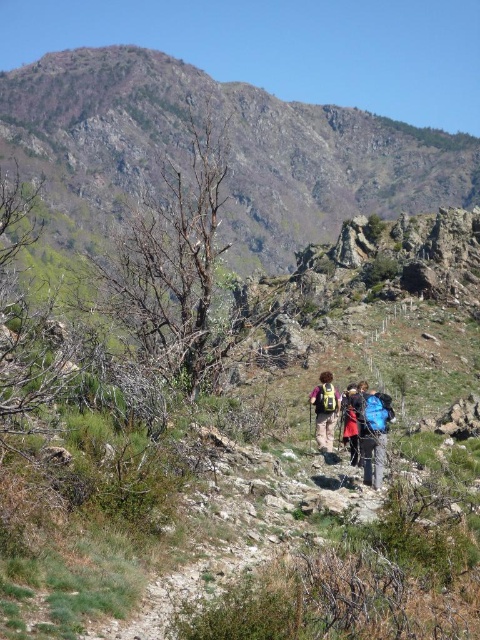
Can you confirm if rugged rock mountain at center is positioned to the left of blue fabric backpack at center?

Indeed, rugged rock mountain at center is positioned on the left side of blue fabric backpack at center.

Is rugged rock mountain at center shorter than blue fabric backpack at center?

No, rugged rock mountain at center is not shorter than blue fabric backpack at center.

At what (x,y) coordinates should I click in order to perform the action: click on rugged rock mountain at center. Please return your answer as a coordinate pair (x, y). This screenshot has height=640, width=480. Looking at the image, I should click on (229, 150).

Who is shorter, blue fabric backpack at center or yellow backpack at center?

blue fabric backpack at center is shorter.

Is the position of blue fabric backpack at center less distant than that of yellow backpack at center?

Yes, blue fabric backpack at center is closer to the viewer.

The height and width of the screenshot is (640, 480). Find the location of `blue fabric backpack at center`. blue fabric backpack at center is located at coordinates (373, 433).

Locate an element on the screen. blue fabric backpack at center is located at coordinates (373, 433).

Does yellow backpack at center have a smaller size compared to red fabric backpack at center?

No.

Between point (325, 445) and point (342, 410), which one is positioned in front?

Point (342, 410) is in front.

Where is `yellow backpack at center`? The width and height of the screenshot is (480, 640). yellow backpack at center is located at coordinates [x=324, y=410].

Locate an element on the screen. The height and width of the screenshot is (640, 480). yellow backpack at center is located at coordinates (324, 410).